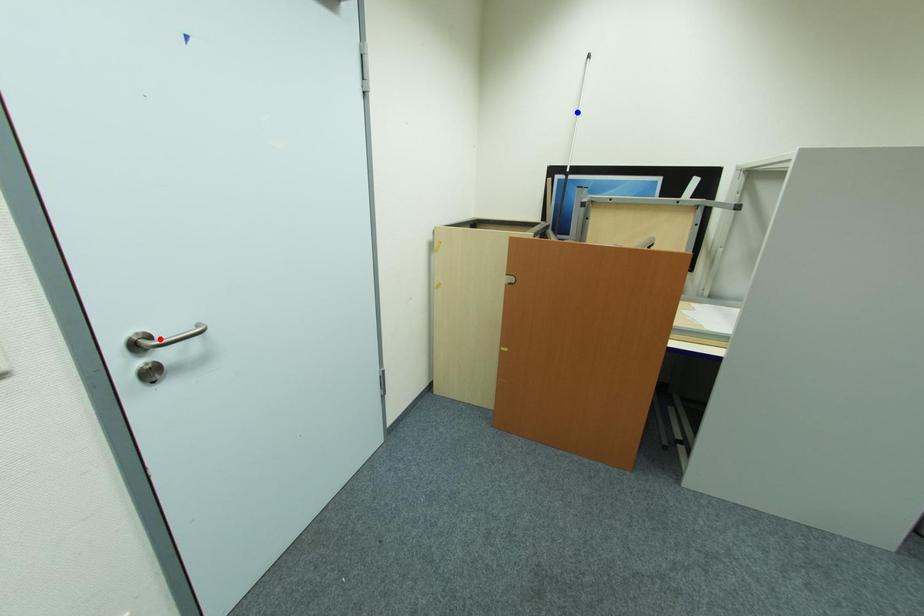
Question: Two points are marked on the image. Which point is closer to the camera?

Choices:
 (A) Blue point is closer.
 (B) Red point is closer.

Answer: (B)